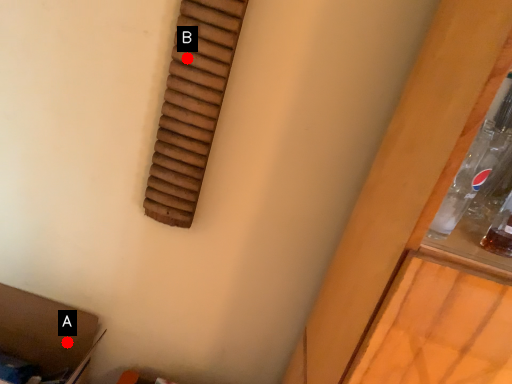
Question: Two points are circled on the image, labeled by A and B beside each circle. Among these points, which one is farthest from the camera?

Choices:
 (A) A is further
 (B) B is further

Answer: (A)